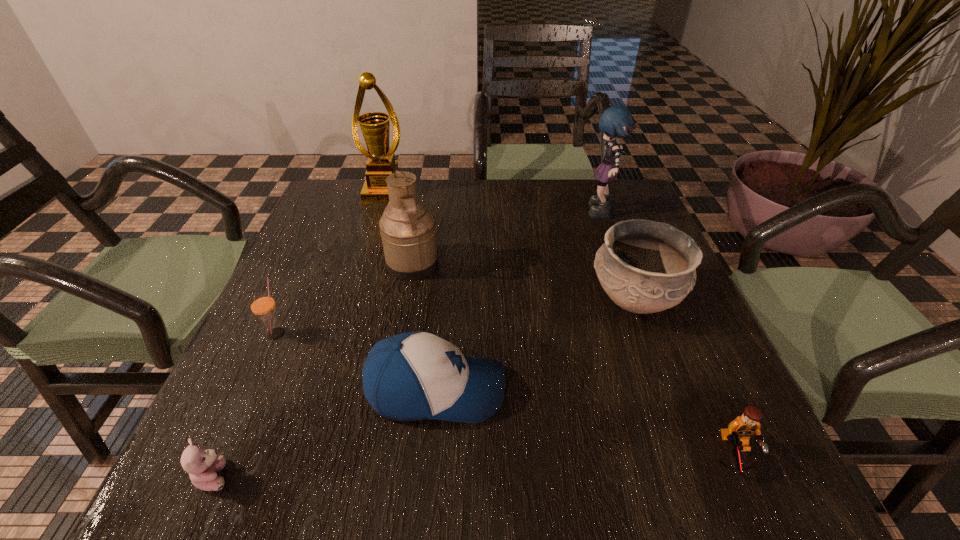
Locate an element on the screen. free location located on the front-facing side of the second tallest object is located at coordinates (444, 214).

I want to click on vacant area located 0.310m on the front-facing side of the second tallest object, so click(x=472, y=214).

What are the coordinates of `vacant space situated on the front of the pitcher` in the screenshot? It's located at (404, 311).

Find the location of a particular element. free location located 0.240m on the front of the pottery is located at coordinates (688, 447).

At what (x,y) coordinates should I click in order to perform the action: click on free space located 0.190m on the back of the straw. Please return your answer as a coordinate pair (x, y). The height and width of the screenshot is (540, 960). Looking at the image, I should click on (306, 266).

At what (x,y) coordinates should I click in order to perform the action: click on free space located on the front-facing side of the baseball cap. Please return your answer as a coordinate pair (x, y). The height and width of the screenshot is (540, 960). Looking at the image, I should click on (705, 389).

Image resolution: width=960 pixels, height=540 pixels. Find the location of `blank space located at the face of the teddy bear`. blank space located at the face of the teddy bear is located at coordinates (426, 476).

The width and height of the screenshot is (960, 540). I want to click on award located at the far edge, so click(x=381, y=163).

Locate an element on the screen. The width and height of the screenshot is (960, 540). rag doll located at the far edge is located at coordinates (616, 121).

Where is `Lego located in the near edge section of the desktop`? The image size is (960, 540). Lego located in the near edge section of the desktop is located at coordinates (739, 431).